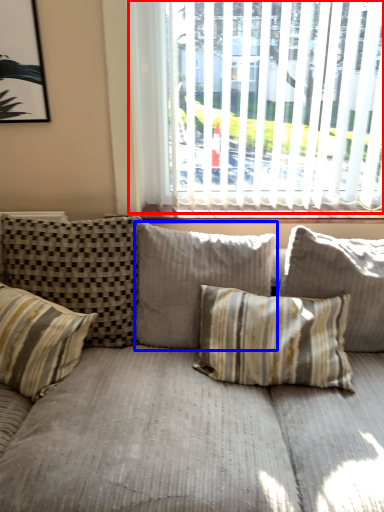
Question: Which object is closer to the camera taking this photo, window (highlighted by a red box) or pillow (highlighted by a blue box)?

Choices:
 (A) window
 (B) pillow

Answer: (B)